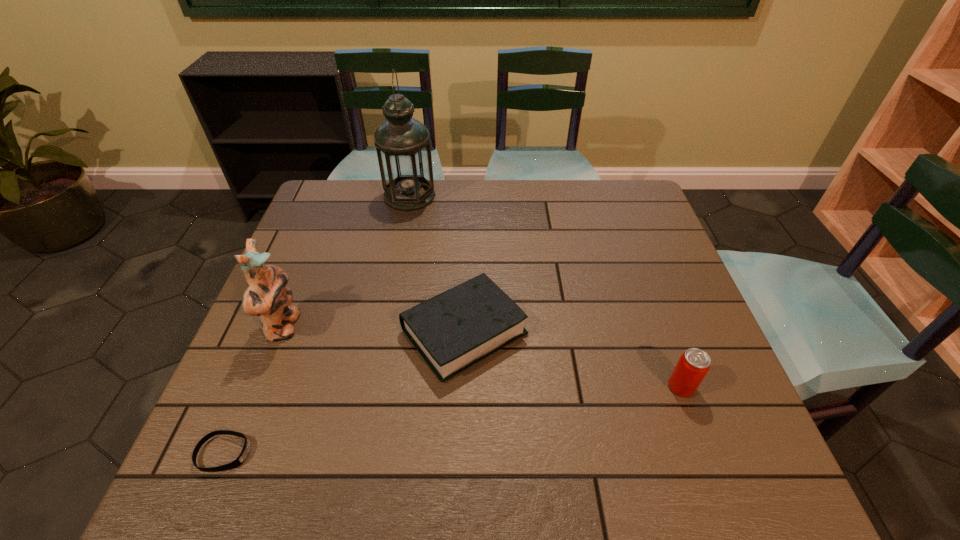
The image size is (960, 540). What are the coordinates of `free spot between the figurine and the oil lamp` in the screenshot? It's located at (347, 261).

Identify the location of free space between the third shortest object and the shortest object. Image resolution: width=960 pixels, height=540 pixels. (452, 420).

I want to click on free spot between the Bible and the tallest object, so click(437, 264).

The height and width of the screenshot is (540, 960). In order to click on object identified as the third closest to the oil lamp in this screenshot , I will do pos(237,462).

At what (x,y) coordinates should I click in order to perform the action: click on object that stands as the fourth closest to the fourth tallest object. Please return your answer as a coordinate pair (x, y). This screenshot has height=540, width=960. Looking at the image, I should click on (402, 143).

Where is `vacant point that satisfies the following two spatial constraints: 1. on the front-facing side of the third shortest object; 2. on the left side of the fourth shortest object`? vacant point that satisfies the following two spatial constraints: 1. on the front-facing side of the third shortest object; 2. on the left side of the fourth shortest object is located at coordinates (260, 387).

In order to click on vacant space that satisfies the following two spatial constraints: 1. on the front side of the farthest object; 2. on the right side of the Bible in this screenshot , I will do `click(383, 332)`.

The height and width of the screenshot is (540, 960). Find the location of `free location that satisfies the following two spatial constraints: 1. on the front-facing side of the fourth shortest object; 2. on the back side of the fourth tallest object`. free location that satisfies the following two spatial constraints: 1. on the front-facing side of the fourth shortest object; 2. on the back side of the fourth tallest object is located at coordinates (282, 332).

You are a GUI agent. You are given a task and a screenshot of the screen. Output one action in this format:
    pyautogui.click(x=<x>, y=<y>)
    Task: Click on the vacant space that satisfies the following two spatial constraints: 1. on the front side of the can; 2. on the display of the nearest object
    This screenshot has height=540, width=960.
    Given the screenshot: What is the action you would take?
    pyautogui.click(x=706, y=453)